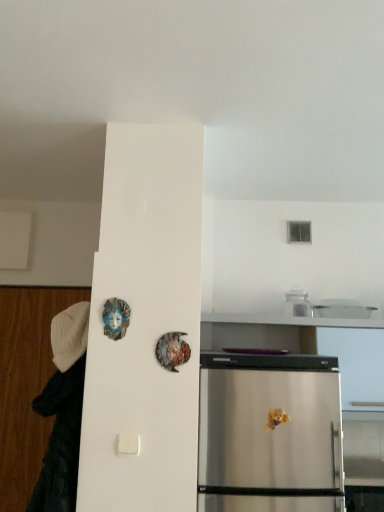
Question: In terms of height, does shiny metallic mask at center look taller or shorter compared to white fabric at left?

Choices:
 (A) short
 (B) tall

Answer: (A)

Question: In terms of size, does shiny metallic mask at center appear bigger or smaller than white fabric at left?

Choices:
 (A) small
 (B) big

Answer: (A)

Question: In the image, is shiny metallic mask at center positioned in front of or behind white fabric at left?

Choices:
 (A) behind
 (B) front

Answer: (B)

Question: From the image's perspective, relative to shiny metallic mask at center, is white fabric at left above or below?

Choices:
 (A) below
 (B) above

Answer: (A)

Question: Looking at their shapes, would you say white fabric at left is wider or thinner than shiny metallic mask at center?

Choices:
 (A) thin
 (B) wide

Answer: (B)

Question: Considering the positions of point (66, 420) and point (178, 334), is point (66, 420) closer or farther from the camera than point (178, 334)?

Choices:
 (A) closer
 (B) farther

Answer: (B)

Question: Is white fabric at left to the left or to the right of shiny metallic mask at center in the image?

Choices:
 (A) left
 (B) right

Answer: (A)